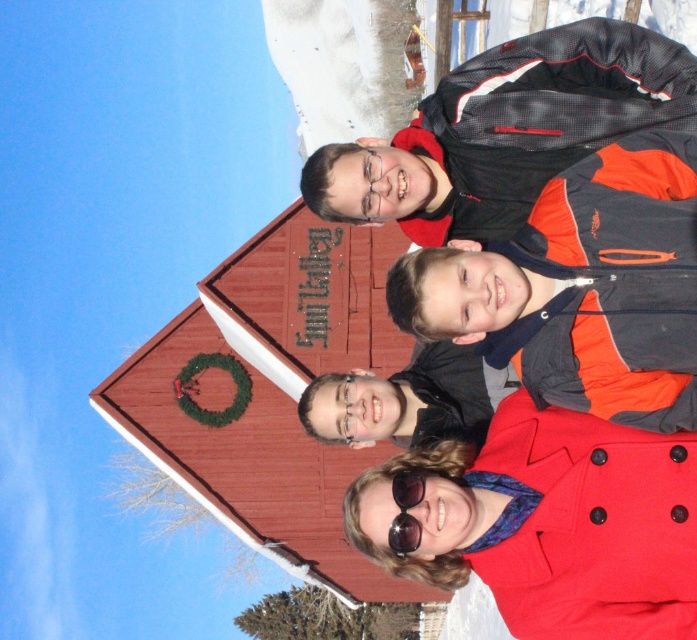
Who is more distant from viewer, (415, 488) or (352, 381)?

Positioned behind is point (352, 381).

Is point (395, 538) positioned before point (353, 442)?

Yes.

I want to click on black reflective sunglasses at center, so click(x=406, y=512).

Does orange and black jacket at upper right have a greater width compared to black reflective sunglasses at center?

Yes, orange and black jacket at upper right is wider than black reflective sunglasses at center.

Who is lower down, orange and black jacket at upper right or black reflective sunglasses at center?

Positioned lower is black reflective sunglasses at center.

Consider the image. Measure the distance between orange and black jacket at upper right and camera.

orange and black jacket at upper right and camera are 190.98 feet apart.

In order to click on orange and black jacket at upper right in this screenshot , I will do (x=505, y=131).

Who is more distant from viewer, (436,547) or (404,477)?

Positioned behind is point (404,477).

Is red matte coat at lower right positioned behind black reflective sunglasses at center?

That is False.

The width and height of the screenshot is (697, 640). I want to click on red matte coat at lower right, so click(551, 522).